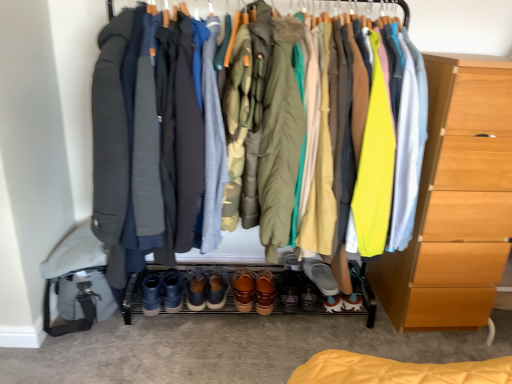
Question: Which direction should I rotate to look at brown leather shoes at center, the fourth footwear in the right-to-left sequence?

Choices:
 (A) right
 (B) left

Answer: (B)

Question: Considering the relative positions of brown suede shoes at center, placed as the 2th footwear when sorted from left to right, and matte black jacket at center in the image provided, is brown suede shoes at center, placed as the 2th footwear when sorted from left to right, to the left of matte black jacket at center from the viewer's perspective?

Choices:
 (A) no
 (B) yes

Answer: (B)

Question: From a real-world perspective, is brown suede shoes at center, the fifth footwear in the right-to-left sequence, under matte black jacket at center?

Choices:
 (A) no
 (B) yes

Answer: (B)

Question: Considering the relative positions of brown suede shoes at center, placed as the 2th footwear when sorted from left to right, and matte black jacket at center in the image provided, is brown suede shoes at center, placed as the 2th footwear when sorted from left to right, behind matte black jacket at center?

Choices:
 (A) yes
 (B) no

Answer: (A)

Question: From the image's perspective, is brown suede shoes at center, placed as the 2th footwear when sorted from left to right, located above matte black jacket at center?

Choices:
 (A) yes
 (B) no

Answer: (B)

Question: Is brown suede shoes at center, placed as the 2th footwear when sorted from left to right, closer to the viewer compared to matte black jacket at center?

Choices:
 (A) no
 (B) yes

Answer: (A)

Question: Does brown suede shoes at center, placed as the 2th footwear when sorted from left to right, turn towards matte black jacket at center?

Choices:
 (A) yes
 (B) no

Answer: (A)

Question: Considering the relative positions of gray woolen robe at center, placed as the second robe when sorted from left to right, and brown leather shoes at center, which is the second footwear from right to left, in the image provided, is gray woolen robe at center, placed as the second robe when sorted from left to right, behind brown leather shoes at center, which is the second footwear from right to left,?

Choices:
 (A) no
 (B) yes

Answer: (A)

Question: Is gray woolen robe at center, placed as the second robe when sorted from left to right, smaller than brown leather shoes at center, which is the second footwear from right to left?

Choices:
 (A) no
 (B) yes

Answer: (A)

Question: Is gray woolen robe at center, the 3th robe positioned from the right, in contact with brown leather shoes at center, the 5th footwear when ordered from left to right?

Choices:
 (A) yes
 (B) no

Answer: (B)

Question: Does gray woolen robe at center, placed as the second robe when sorted from left to right, have a greater height compared to brown leather shoes at center, the 5th footwear when ordered from left to right?

Choices:
 (A) yes
 (B) no

Answer: (A)

Question: From the image's perspective, would you say gray woolen robe at center, placed as the second robe when sorted from left to right, is shown under brown leather shoes at center, which is the second footwear from right to left?

Choices:
 (A) no
 (B) yes

Answer: (A)

Question: Considering the relative sizes of gray woolen robe at center, the 3th robe positioned from the right, and brown leather shoes at center, the 5th footwear when ordered from left to right, in the image provided, is gray woolen robe at center, the 3th robe positioned from the right, shorter than brown leather shoes at center, the 5th footwear when ordered from left to right,?

Choices:
 (A) yes
 (B) no

Answer: (B)

Question: Does brown suede shoes at center, the sixth footwear positioned from the right, have a larger size compared to brown leather shoes at center, the fourth footwear in the right-to-left sequence?

Choices:
 (A) yes
 (B) no

Answer: (A)